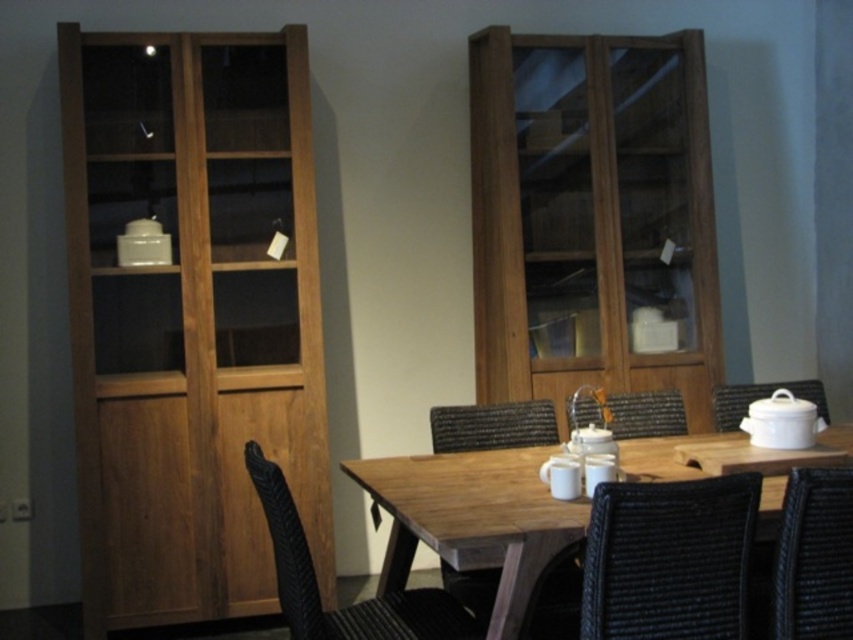
Question: Which point is closer to the camera?

Choices:
 (A) woven rattan chair at center
 (B) white ceramic pot at right
 (C) black woven chair at center

Answer: (C)

Question: Which object is the farthest from the wooden table at center?

Choices:
 (A) black woven chair at center
 (B) brown wooden cabinet at center
 (C) brown woven chair at center
 (D) black woven chair at lower right

Answer: (B)

Question: Observing the image, what is the correct spatial positioning of brown wooden cabinet at center in reference to rattan chair at center?

Choices:
 (A) below
 (B) above

Answer: (B)

Question: Which point is farther from the camera taking this photo?

Choices:
 (A) (479, 252)
 (B) (810, 522)
 (C) (646, 426)
 (D) (758, 388)

Answer: (A)

Question: Is rattan chair at center smaller than woven rattan chair at center?

Choices:
 (A) yes
 (B) no

Answer: (B)

Question: Is brown woven chair at center smaller than woven rattan chair at center?

Choices:
 (A) yes
 (B) no

Answer: (B)